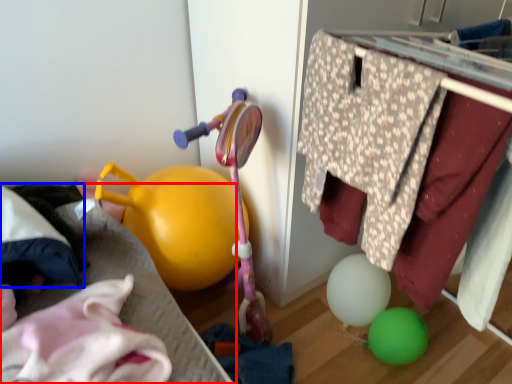
Question: Among these objects, which one is nearest to the camera, bed frame (highlighted by a red box) or clothing (highlighted by a blue box)?

Choices:
 (A) bed frame
 (B) clothing

Answer: (A)